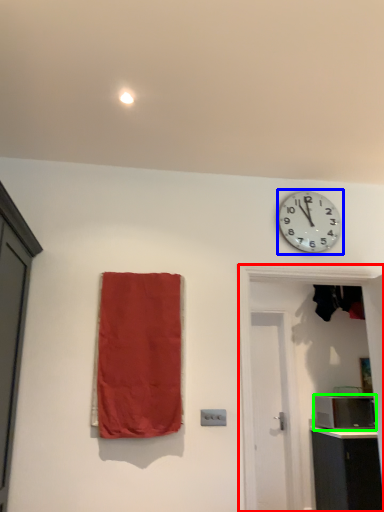
Question: Estimate the real-world distances between objects in this image. Which object is closer to door (highlighted by a red box), wall clock (highlighted by a blue box) or appliance (highlighted by a green box)?

Choices:
 (A) wall clock
 (B) appliance

Answer: (A)